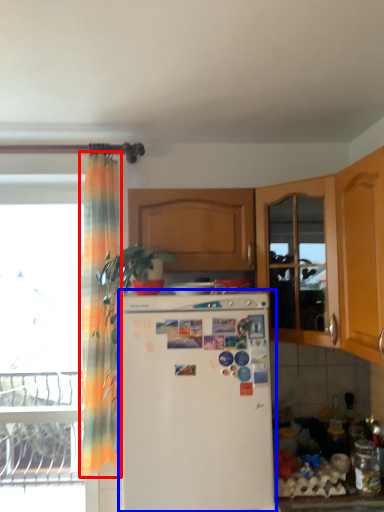
Question: Which object appears farthest to the camera in this image, curtain (highlighted by a red box) or refrigerator (highlighted by a blue box)?

Choices:
 (A) curtain
 (B) refrigerator

Answer: (A)